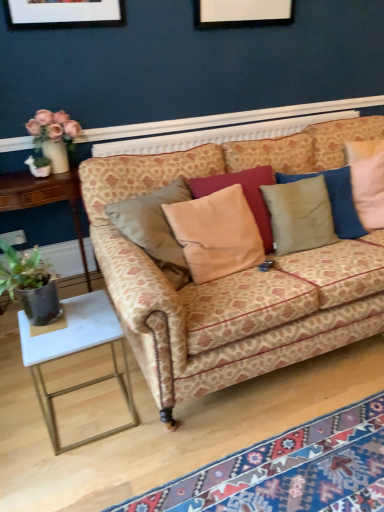
The height and width of the screenshot is (512, 384). What are the coordinates of `vacant area that is in front of white marble side table at lower left, which is the first table in front-to-back order` in the screenshot? It's located at (74, 474).